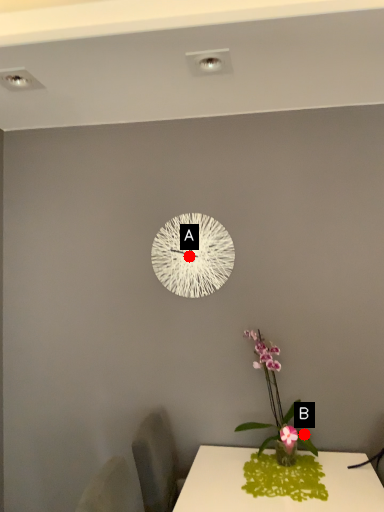
Question: Two points are circled on the image, labeled by A and B beside each circle. Which point is farther from the camera taking this photo?

Choices:
 (A) A is further
 (B) B is further

Answer: (A)